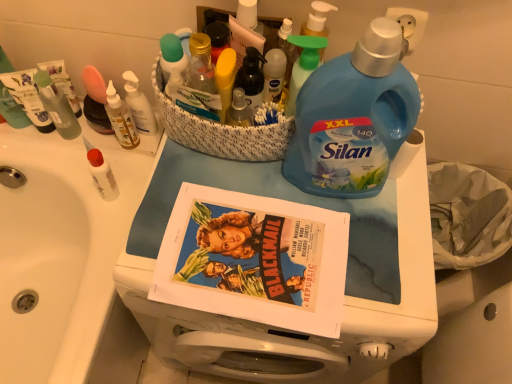
I want to click on vacant space to the left of translucent plastic bottles at upper left, which is the 2th toiletry from left to right, so click(53, 151).